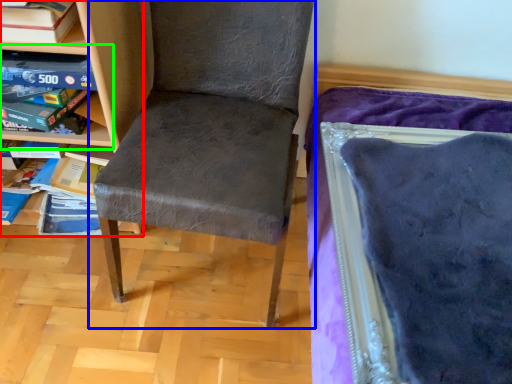
Question: Which is farther away from shelf (highlighted by a red box)? chair (highlighted by a blue box) or shelf (highlighted by a green box)?

Choices:
 (A) chair
 (B) shelf

Answer: (A)